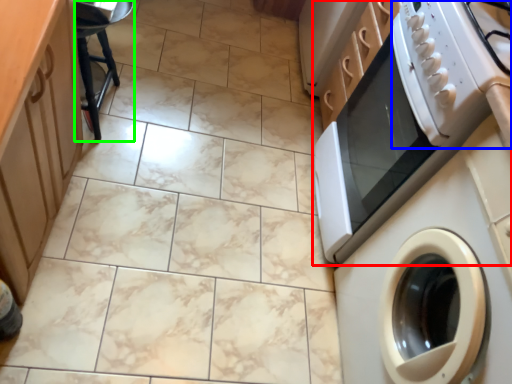
Question: Estimate the real-world distances between objects in this image. Which object is farther from home appliance (highlighted by a red box), gas stove (highlighted by a blue box) or bar stool (highlighted by a green box)?

Choices:
 (A) gas stove
 (B) bar stool

Answer: (B)